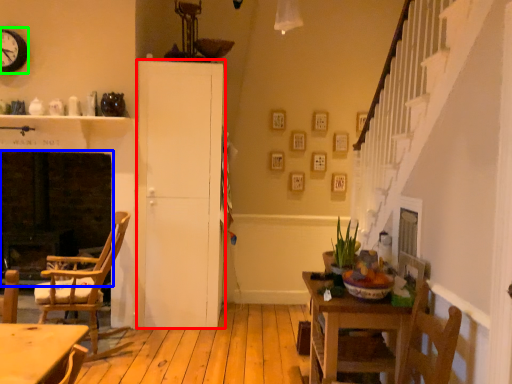
Question: Which object is the closest to the cabinetry (highlighted by a red box)? Choose among these: fireplace (highlighted by a blue box) or clock (highlighted by a green box).

Choices:
 (A) fireplace
 (B) clock

Answer: (A)